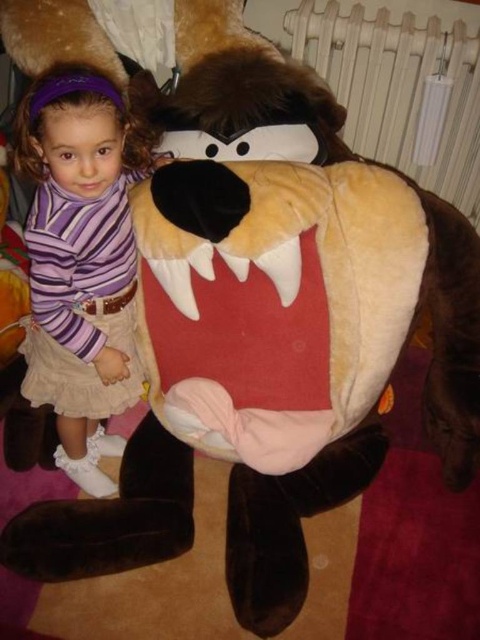
What do you see at coordinates (84, 259) in the screenshot?
I see `purple striped shirt at left` at bounding box center [84, 259].

Between purple striped shirt at left and white plastic radiator at upper center, which one has more height?

With more height is purple striped shirt at left.

What do you see at coordinates (84, 259) in the screenshot?
I see `purple striped shirt at left` at bounding box center [84, 259].

This screenshot has height=640, width=480. What are the coordinates of `purple striped shirt at left` in the screenshot? It's located at (84, 259).